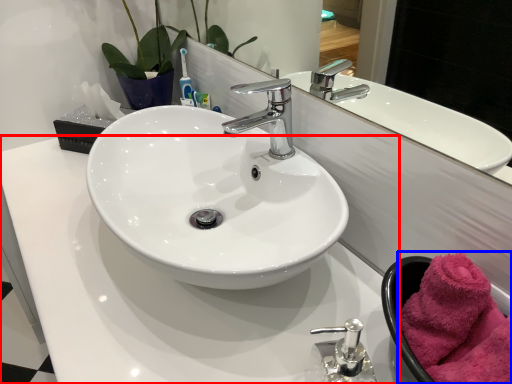
Question: Among these objects, which one is farthest to the camera, counter top (highlighted by a red box) or bath towel (highlighted by a blue box)?

Choices:
 (A) counter top
 (B) bath towel

Answer: (B)